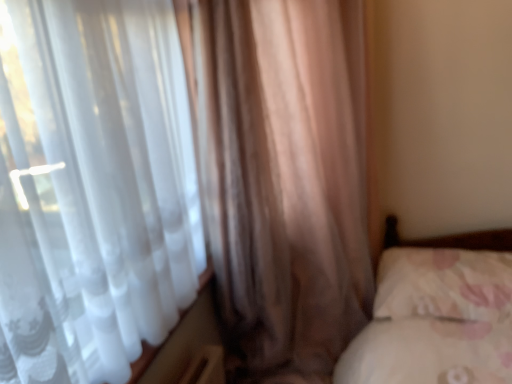
Question: In terms of size, does translucent fabric curtain at left, the first curtain when ordered from right to left, appear bigger or smaller than fluffy white pillow at lower right?

Choices:
 (A) big
 (B) small

Answer: (A)

Question: Considering the positions of point (290, 233) and point (438, 309), is point (290, 233) closer or farther from the camera than point (438, 309)?

Choices:
 (A) farther
 (B) closer

Answer: (A)

Question: Based on their relative distances, which object is farther from the satin brown curtain at left, the second curtain positioned from the right?

Choices:
 (A) translucent fabric curtain at left, the first curtain when ordered from right to left
 (B) fluffy white pillow at lower right

Answer: (B)

Question: Which object is the farthest from the satin brown curtain at left, the second curtain positioned from the right?

Choices:
 (A) translucent fabric curtain at left, the first curtain when ordered from right to left
 (B) fluffy white pillow at lower right

Answer: (B)